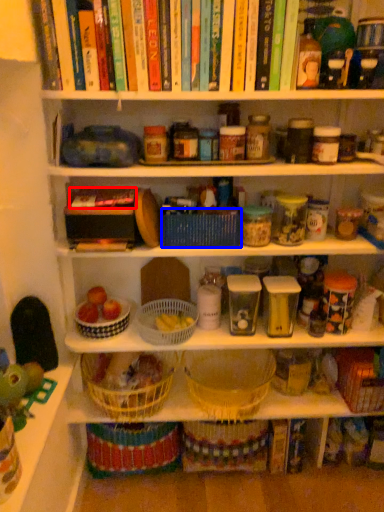
Question: Which point is further to the camera, book (highlighted by a red box) or basket (highlighted by a blue box)?

Choices:
 (A) book
 (B) basket

Answer: (B)